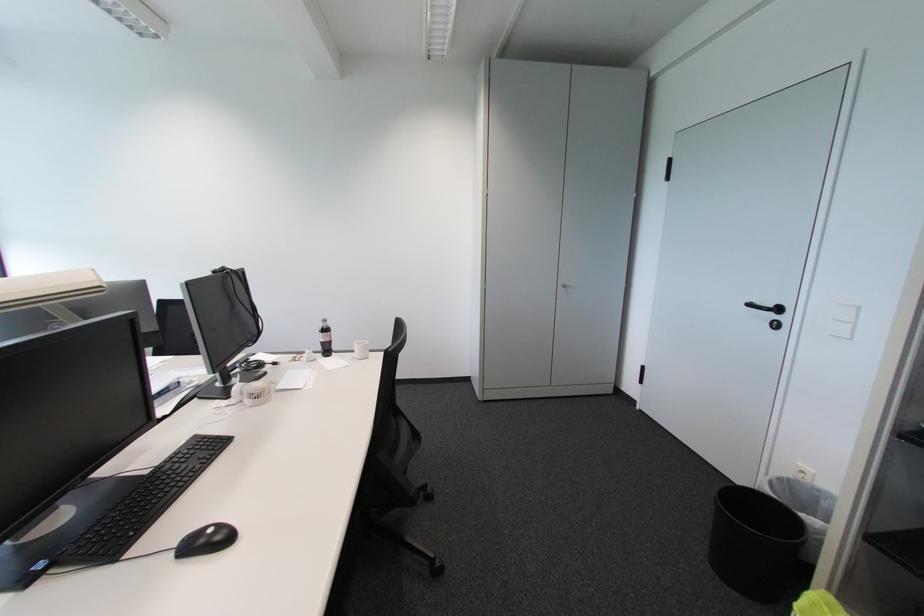
You are a GUI agent. You are given a task and a screenshot of the screen. Output one action in this format:
    pyautogui.click(x=<x>, y=<y>)
    Task: Click on the coca-cola bottle
    The height and width of the screenshot is (616, 924).
    Given the screenshot: What is the action you would take?
    pyautogui.click(x=324, y=339)